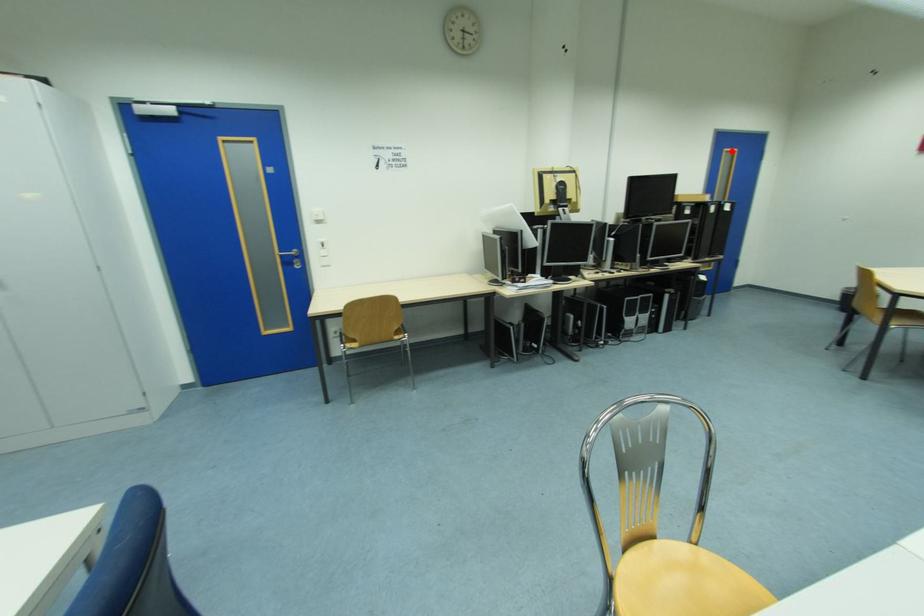
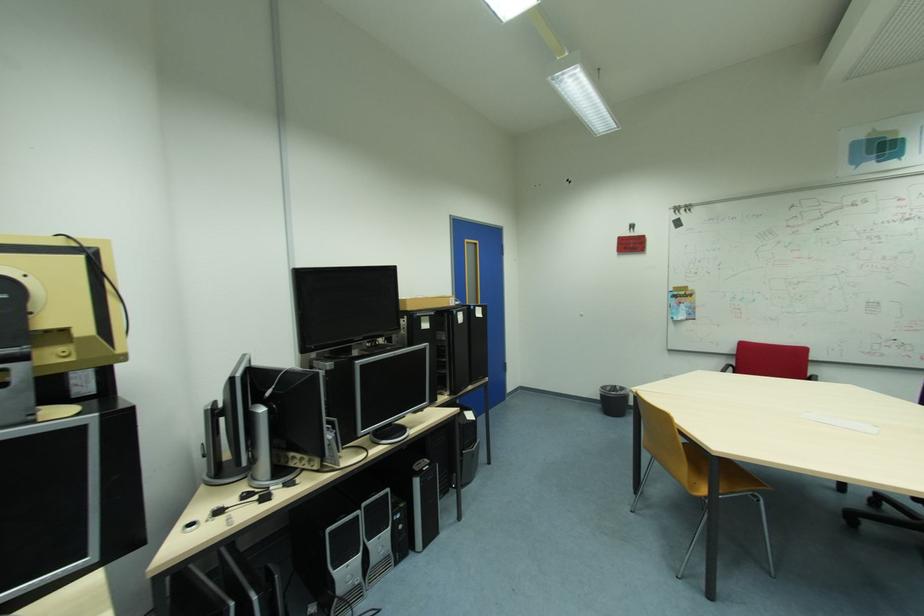
Find the pixel in the second image that matches the highlighted location in the first image.

(473, 241)